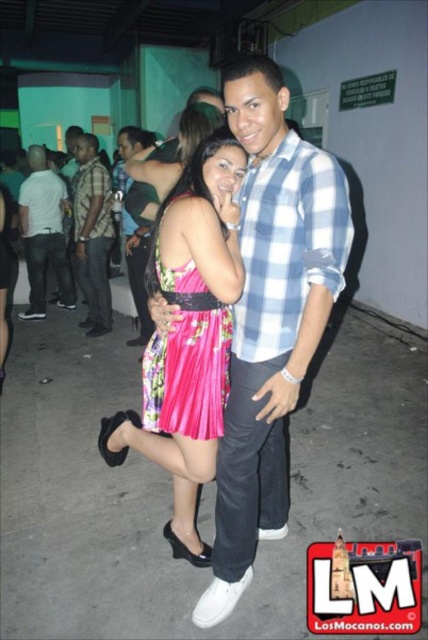
You are at a party and want to greet both the person wearing the pink satin dress at center and the person wearing the brushed metal shirt at left. If you start from the entrance, which person should you approach first to minimize the walking distance?

The pink satin dress at center is closer to the entrance than the brushed metal shirt at left, so you should approach the person wearing the pink satin dress at center first to minimize walking distance.

You are a photographer at the event and want to ensure both the pink satin dress at center and the brushed metal shirt at left are visible in your photo. Given their heights, which one might you need to adjust your camera angle for to capture both properly?

The pink satin dress at center has a lesser height compared to the brushed metal shirt at left. To capture both properly, you might need to lower your camera angle slightly to ensure the taller brushed metal shirt at left doesn not block the shorter pink satin dress at center.